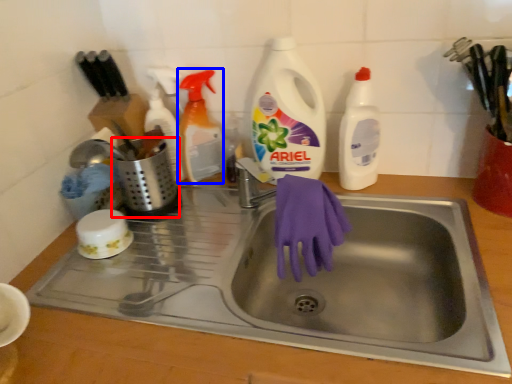
Question: Which object appears farthest to the camera in this image, appliance (highlighted by a red box) or cleaning product (highlighted by a blue box)?

Choices:
 (A) appliance
 (B) cleaning product

Answer: (B)